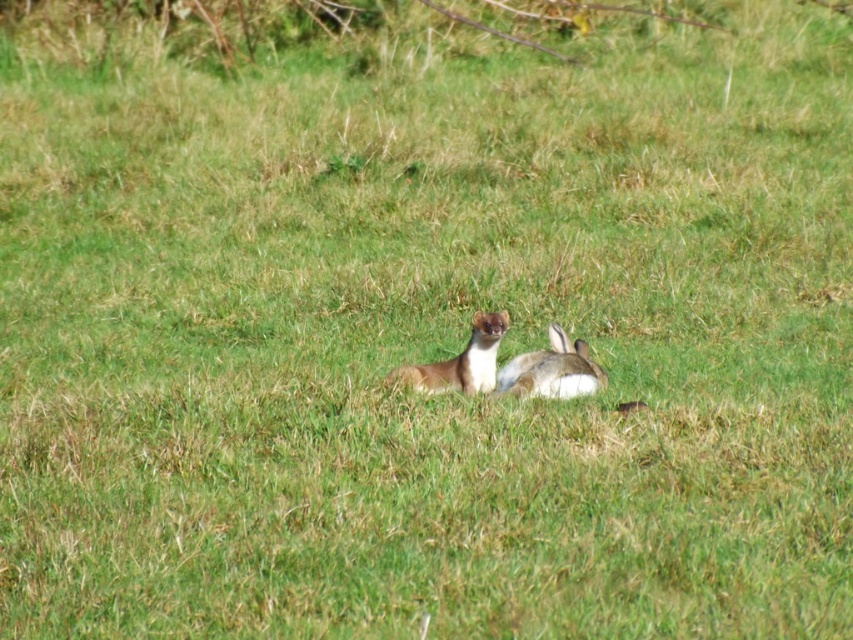
Question: Among these objects, which one is nearest to the camera?

Choices:
 (A) furry white rabbit at center
 (B) furry brown animal at center

Answer: (A)

Question: Can you confirm if furry white rabbit at center is positioned above furry brown animal at center?

Choices:
 (A) yes
 (B) no

Answer: (A)

Question: Can you confirm if furry white rabbit at center is positioned to the left of furry brown animal at center?

Choices:
 (A) yes
 (B) no

Answer: (B)

Question: Is furry white rabbit at center positioned behind furry brown animal at center?

Choices:
 (A) no
 (B) yes

Answer: (A)

Question: Which point is closer to the camera?

Choices:
 (A) (543, 355)
 (B) (480, 328)

Answer: (B)

Question: Which of the following is the farthest from the observer?

Choices:
 (A) furry white rabbit at center
 (B) furry brown animal at center

Answer: (B)